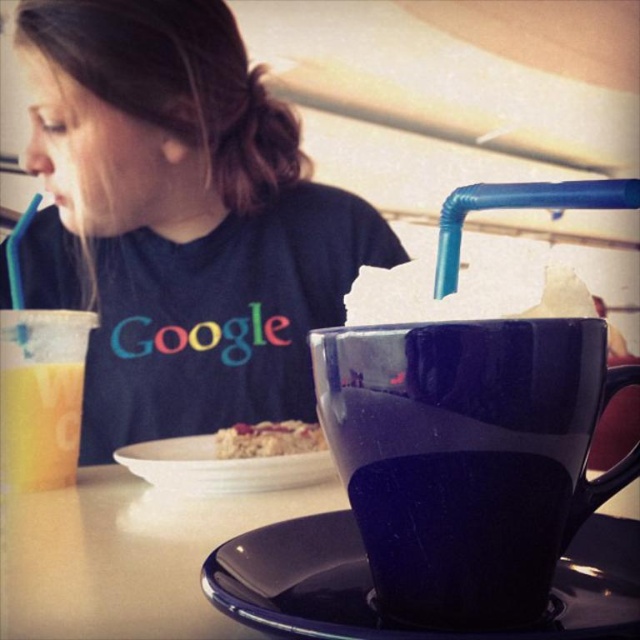
Question: Which object appears farthest from the camera in this image?

Choices:
 (A) glossy ceramic saucer at lower center
 (B) translucent plastic cup at left
 (C) glossy ceramic mug at upper center

Answer: (B)

Question: Does glossy ceramic saucer at lower center appear on the left side of white matte plate at center?

Choices:
 (A) yes
 (B) no

Answer: (B)

Question: Which is nearer to the matte black t-shirt at upper left?

Choices:
 (A) glossy ceramic mug at upper center
 (B) white matte plate at center

Answer: (B)

Question: Can you confirm if matte black t-shirt at upper left is bigger than glossy ceramic mug at upper center?

Choices:
 (A) yes
 (B) no

Answer: (A)

Question: Which point is farther from the camera taking this photo?

Choices:
 (A) (243, 468)
 (B) (461, 332)
 (C) (35, 172)

Answer: (C)

Question: Can you confirm if glossy ceramic mug at upper center is thinner than smooth white table at center?

Choices:
 (A) no
 (B) yes

Answer: (B)